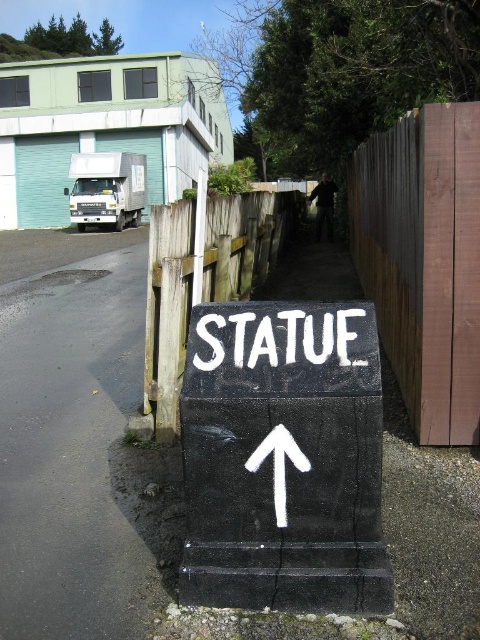
Who is lower down, brown wood fence at right or white matte arrow at center?

white matte arrow at center is below.

Can you confirm if brown wood fence at right is taller than white matte arrow at center?

Yes, brown wood fence at right is taller than white matte arrow at center.

The width and height of the screenshot is (480, 640). I want to click on brown wood fence at right, so click(423, 260).

Is wooden fence at center taller than white matte arrow at center?

Indeed, wooden fence at center has a greater height compared to white matte arrow at center.

Between wooden fence at center and white matte arrow at center, which one is positioned higher?

wooden fence at center is above.

Does point (159, 246) come behind point (278, 436)?

Yes, point (159, 246) is behind point (278, 436).

The image size is (480, 640). Find the location of `wooden fence at center`. wooden fence at center is located at coordinates (167, 312).

Between brown wood fence at right and wooden fence at center, which one is positioned higher?

wooden fence at center is higher up.

You are a GUI agent. You are given a task and a screenshot of the screen. Output one action in this format:
    pyautogui.click(x=<x>, y=<y>)
    Task: Click on the brown wood fence at right
    The image size is (480, 640).
    Given the screenshot: What is the action you would take?
    pyautogui.click(x=423, y=260)

Find the location of a particular element. brown wood fence at right is located at coordinates (423, 260).